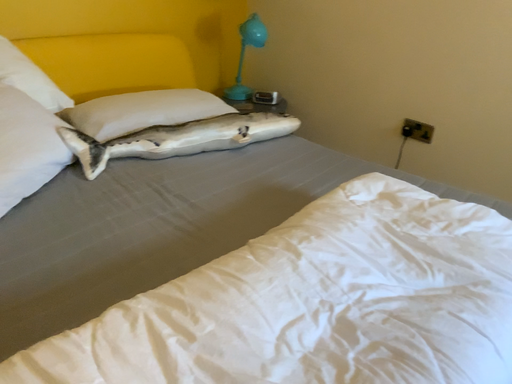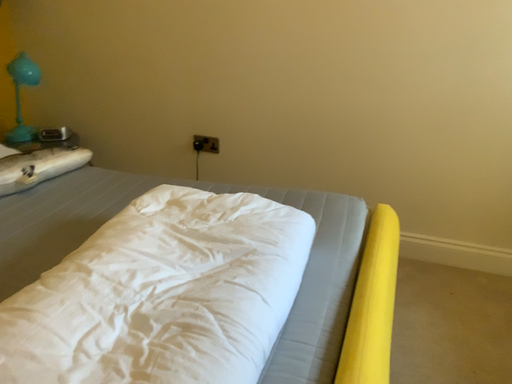
Question: How did the camera likely rotate when shooting the video?

Choices:
 (A) rotated right
 (B) rotated left

Answer: (A)